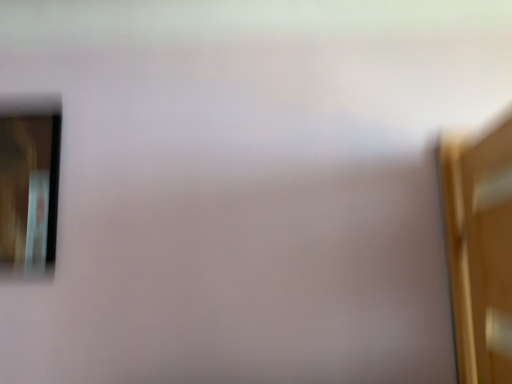
What do you see at coordinates (29, 187) in the screenshot?
I see `clear glass window at left` at bounding box center [29, 187].

In order to click on clear glass window at left in this screenshot , I will do `click(29, 187)`.

Image resolution: width=512 pixels, height=384 pixels. What are the coordinates of `clear glass window at left` in the screenshot? It's located at (29, 187).